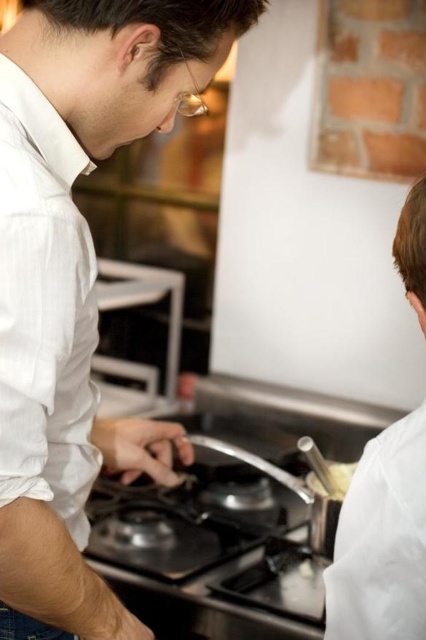
Describe the element at coordinates (77, 282) in the screenshot. This screenshot has height=640, width=426. I see `white matte shirt at center` at that location.

Between white matte shirt at center and white glossy spoon at upper right, which one has less height?

Standing shorter between the two is white glossy spoon at upper right.

Between point (17, 371) and point (351, 472), which one is positioned behind?

Positioned behind is point (351, 472).

The image size is (426, 640). I want to click on white matte shirt at center, so click(x=77, y=282).

Which is in front, point (195, 92) or point (353, 536)?

Point (353, 536)

Can you confirm if white matte shirt at center is positioned to the right of white matte chef coat at right?

No, white matte shirt at center is not to the right of white matte chef coat at right.

Between point (86, 444) and point (363, 467), which one is positioned behind?

Point (86, 444)

The height and width of the screenshot is (640, 426). In order to click on white matte shirt at center in this screenshot , I will do `click(77, 282)`.

Who is lower down, white matte chef coat at right or white glossy spoon at upper right?

Positioned lower is white glossy spoon at upper right.

Between white matte chef coat at right and white glossy spoon at upper right, which one appears on the left side from the viewer's perspective?

Positioned to the left is white matte chef coat at right.

Describe the element at coordinates (382, 540) in the screenshot. I see `white matte chef coat at right` at that location.

Where is `white matte chef coat at right`? white matte chef coat at right is located at coordinates (382, 540).